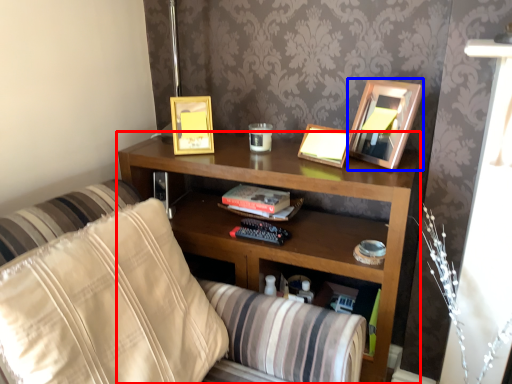
Question: Which object appears closest to the camera in this image, shelf (highlighted by a red box) or picture frame (highlighted by a blue box)?

Choices:
 (A) shelf
 (B) picture frame

Answer: (A)